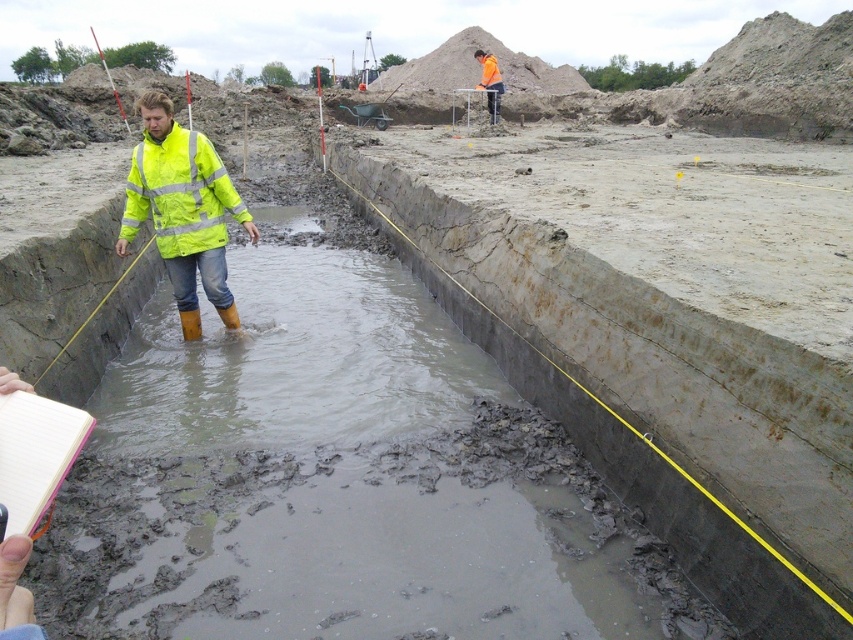
How much distance is there between neon yellow reflective jacket at center and high visibility yellow jacket at center?

18.78 centimeters

Can you confirm if neon yellow reflective jacket at center is positioned to the right of high visibility yellow jacket at center?

Incorrect, neon yellow reflective jacket at center is not on the right side of high visibility yellow jacket at center.

This screenshot has width=853, height=640. Find the location of `neon yellow reflective jacket at center`. neon yellow reflective jacket at center is located at coordinates (183, 211).

I want to click on neon yellow reflective jacket at center, so click(183, 211).

Between high visibility yellow jacket at center and orange reflective jacket at upper center, which one has more height?

orange reflective jacket at upper center is taller.

Image resolution: width=853 pixels, height=640 pixels. What do you see at coordinates (178, 193) in the screenshot? I see `high visibility yellow jacket at center` at bounding box center [178, 193].

Identify the location of high visibility yellow jacket at center. Image resolution: width=853 pixels, height=640 pixels. (178, 193).

Is point (149, 150) less distant than point (498, 80)?

Yes, it is.

Looking at this image, is neon yellow reflective jacket at center further to the viewer compared to orange reflective jacket at upper center?

No.

Find the location of a particular element. neon yellow reflective jacket at center is located at coordinates (183, 211).